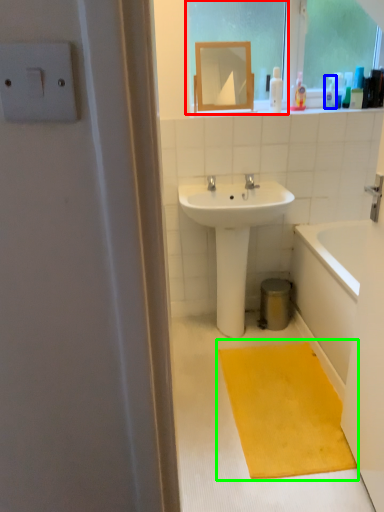
Question: Based on their relative distances, which object is nearer to window screen (highlighted by a red box)? Choose from toiletry (highlighted by a blue box) and doormat (highlighted by a green box).

Choices:
 (A) toiletry
 (B) doormat

Answer: (A)